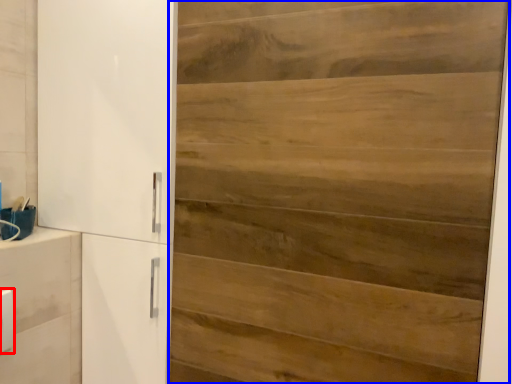
Question: Which object appears closest to the camera in this image, light switch (highlighted by a red box) or door (highlighted by a blue box)?

Choices:
 (A) light switch
 (B) door

Answer: (B)